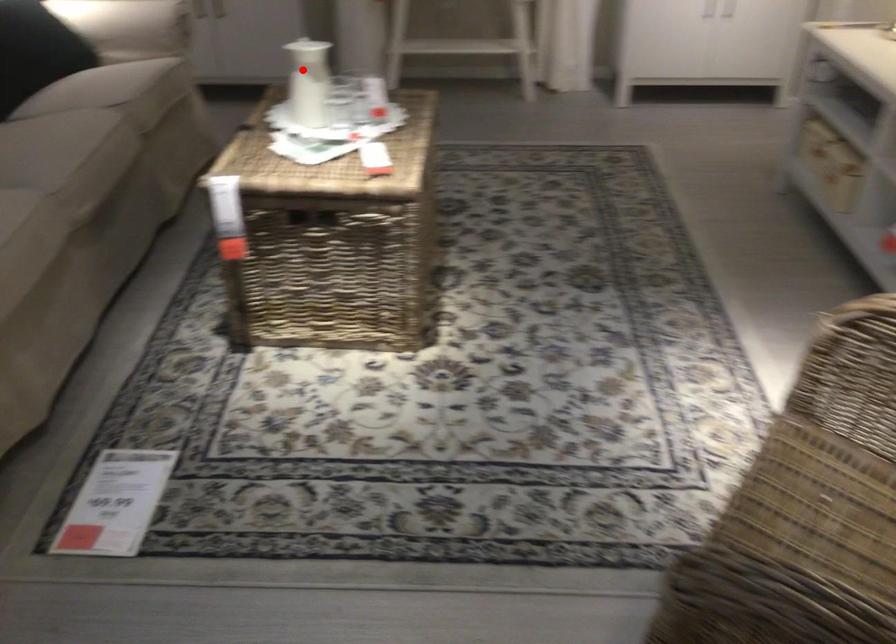
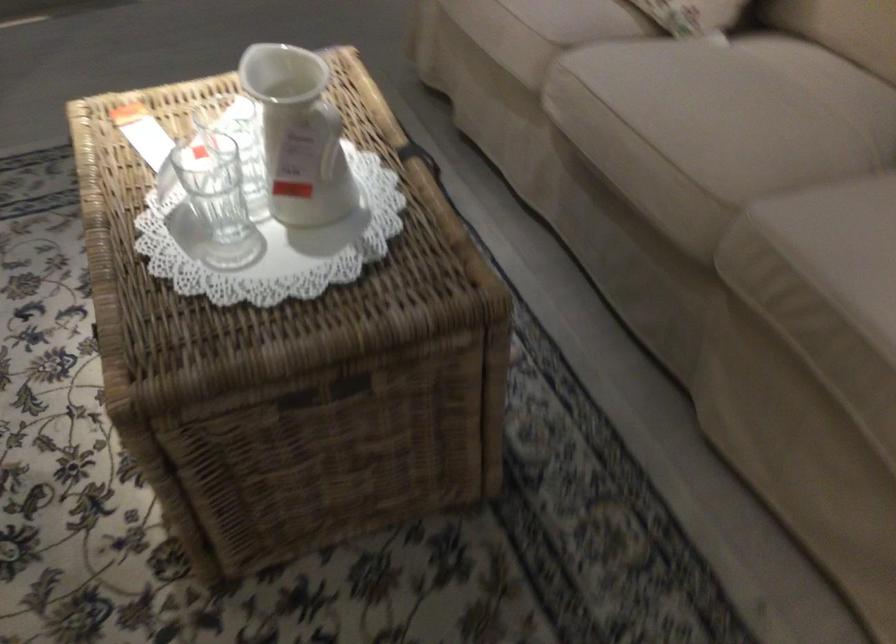
Locate, in the second image, the point that corresponds to the highlighted location in the first image.

(328, 137)